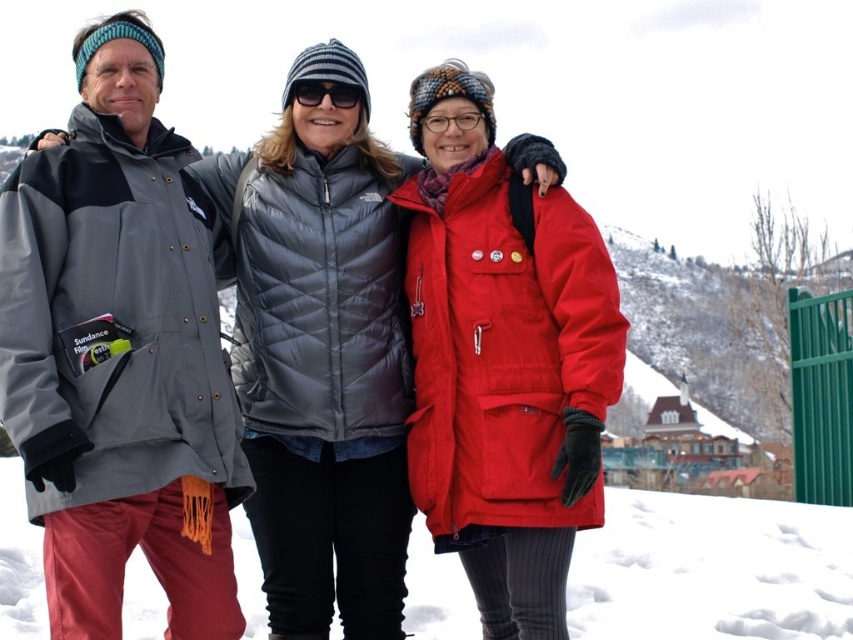
Question: Which of the following is the closest to the observer?

Choices:
 (A) (221, 616)
 (B) (612, 588)

Answer: (A)

Question: Which object is closer to the camera taking this photo?

Choices:
 (A) white snow at lower center
 (B) gray matte jacket at left
 (C) black reflective sunglasses at center
 (D) matte gray puffer jacket at center

Answer: (B)

Question: Which of these objects is positioned closest to the matte gray puffer jacket at center?

Choices:
 (A) black reflective sunglasses at center
 (B) white snow at lower center

Answer: (A)

Question: Observing the image, what is the correct spatial positioning of matte gray puffer jacket at center in reference to black reflective sunglasses at center?

Choices:
 (A) left
 (B) right

Answer: (A)

Question: Does matte gray puffer jacket at center appear under gray matte jacket at left?

Choices:
 (A) no
 (B) yes

Answer: (B)

Question: Can you confirm if white snow at lower center is wider than black reflective sunglasses at center?

Choices:
 (A) no
 (B) yes

Answer: (B)